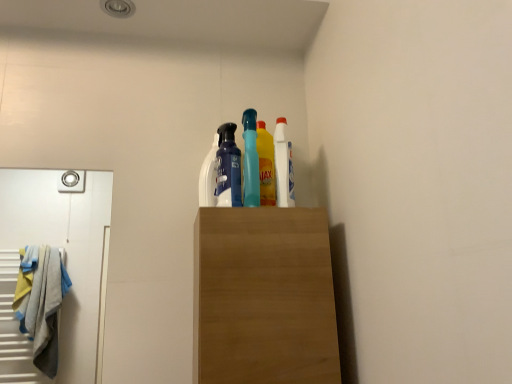
What do you see at coordinates (283, 165) in the screenshot?
I see `white plastic bottle at upper center, marked as the 1th cleaning product in a right-to-left arrangement` at bounding box center [283, 165].

The width and height of the screenshot is (512, 384). In order to click on matte blue spray bottle at center in this screenshot , I will do `click(228, 168)`.

This screenshot has height=384, width=512. Describe the element at coordinates (208, 176) in the screenshot. I see `white glossy bottle at upper center, which is the 1th cleaning product from left to right` at that location.

At what (x,y) coordinates should I click in order to perform the action: click on white plastic bottle at upper center, which ranks as the 2th cleaning product in left-to-right order. Please return your answer as a coordinate pair (x, y). This screenshot has width=512, height=384. Looking at the image, I should click on (283, 165).

From a real-world perspective, who is located lower, white plastic bottle at upper center, which ranks as the 2th cleaning product in left-to-right order, or white glossy bottle at upper center, the 2th cleaning product viewed from the right?

white plastic bottle at upper center, which ranks as the 2th cleaning product in left-to-right order.

Is white plastic bottle at upper center, which ranks as the 2th cleaning product in left-to-right order, completely or partially outside of white glossy bottle at upper center, the 2th cleaning product viewed from the right?

Yes, white plastic bottle at upper center, which ranks as the 2th cleaning product in left-to-right order, is located beyond the bounds of white glossy bottle at upper center, the 2th cleaning product viewed from the right.

Which object is wider, white plastic bottle at upper center, marked as the 1th cleaning product in a right-to-left arrangement, or white glossy bottle at upper center, which is the 1th cleaning product from left to right?

With larger width is white plastic bottle at upper center, marked as the 1th cleaning product in a right-to-left arrangement.

Is white glossy bottle at upper center, which is the 1th cleaning product from left to right, not close to white plastic bottle at upper center, which ranks as the 2th cleaning product in left-to-right order?

No, white glossy bottle at upper center, which is the 1th cleaning product from left to right, is not far away from white plastic bottle at upper center, which ranks as the 2th cleaning product in left-to-right order.

Considering the relative positions of white glossy bottle at upper center, which is the 1th cleaning product from left to right, and white plastic bottle at upper center, which ranks as the 2th cleaning product in left-to-right order, in the image provided, is white glossy bottle at upper center, which is the 1th cleaning product from left to right, to the left or to the right of white plastic bottle at upper center, which ranks as the 2th cleaning product in left-to-right order,?

white glossy bottle at upper center, which is the 1th cleaning product from left to right, is to the left of white plastic bottle at upper center, which ranks as the 2th cleaning product in left-to-right order.

Considering the sizes of white glossy bottle at upper center, the 2th cleaning product viewed from the right, and white plastic bottle at upper center, which ranks as the 2th cleaning product in left-to-right order, in the image, is white glossy bottle at upper center, the 2th cleaning product viewed from the right, wider or thinner than white plastic bottle at upper center, which ranks as the 2th cleaning product in left-to-right order,?

Considering their sizes, white glossy bottle at upper center, the 2th cleaning product viewed from the right, looks slimmer than white plastic bottle at upper center, which ranks as the 2th cleaning product in left-to-right order.

Does white glossy bottle at upper center, which is the 1th cleaning product from left to right, have a lesser height compared to white plastic bottle at upper center, marked as the 1th cleaning product in a right-to-left arrangement?

Yes.

Looking at this image, what's the angular difference between matte blue spray bottle at center and white glossy bottle at upper center, which is the 1th cleaning product from left to right,'s facing directions?

The angular difference between matte blue spray bottle at center and white glossy bottle at upper center, which is the 1th cleaning product from left to right, is 0.00452 degrees.

Consider the image. From a real-world perspective, is matte blue spray bottle at center on white glossy bottle at upper center, which is the 1th cleaning product from left to right?

Yes, from a real-world perspective, matte blue spray bottle at center is above white glossy bottle at upper center, which is the 1th cleaning product from left to right.

Can you confirm if matte blue spray bottle at center is smaller than white glossy bottle at upper center, which is the 1th cleaning product from left to right?

No.

Between white plastic bottle at upper center, marked as the 1th cleaning product in a right-to-left arrangement, and matte blue spray bottle at center, which one has less height?

matte blue spray bottle at center.

Is white plastic bottle at upper center, which ranks as the 2th cleaning product in left-to-right order, to the left of matte blue spray bottle at center from the viewer's perspective?

Incorrect, white plastic bottle at upper center, which ranks as the 2th cleaning product in left-to-right order, is not on the left side of matte blue spray bottle at center.

Which of these two, white plastic bottle at upper center, which ranks as the 2th cleaning product in left-to-right order, or matte blue spray bottle at center, is wider?

matte blue spray bottle at center.

Does point (278, 135) come in front of point (217, 163)?

Yes, it is.

Is matte blue spray bottle at center wider than white plastic bottle at upper center, which ranks as the 2th cleaning product in left-to-right order?

Yes, matte blue spray bottle at center is wider than white plastic bottle at upper center, which ranks as the 2th cleaning product in left-to-right order.

Considering the positions of objects matte blue spray bottle at center and white plastic bottle at upper center, marked as the 1th cleaning product in a right-to-left arrangement, in the image provided, who is behind, matte blue spray bottle at center or white plastic bottle at upper center, marked as the 1th cleaning product in a right-to-left arrangement,?

Positioned behind is white plastic bottle at upper center, marked as the 1th cleaning product in a right-to-left arrangement.

Are matte blue spray bottle at center and white plastic bottle at upper center, marked as the 1th cleaning product in a right-to-left arrangement, making contact?

No, matte blue spray bottle at center is not with white plastic bottle at upper center, marked as the 1th cleaning product in a right-to-left arrangement.

In order to click on the 2nd cleaning product below the matte blue spray bottle at center (from the image's perspective) in this screenshot , I will do `click(208, 176)`.

Is white glossy bottle at upper center, which is the 1th cleaning product from left to right, at the left side of matte blue spray bottle at center?

Correct, you'll find white glossy bottle at upper center, which is the 1th cleaning product from left to right, to the left of matte blue spray bottle at center.

Is the position of white glossy bottle at upper center, the 2th cleaning product viewed from the right, more distant than that of matte blue spray bottle at center?

Yes, it is behind matte blue spray bottle at center.

You are a GUI agent. You are given a task and a screenshot of the screen. Output one action in this format:
    pyautogui.click(x=<x>, y=<y>)
    Task: Click on the cleaning product located on the right of white glossy bottle at upper center, which is the 1th cleaning product from left to right
    This screenshot has height=384, width=512.
    Given the screenshot: What is the action you would take?
    pyautogui.click(x=283, y=165)

I want to click on cleaning product in front of the white glossy bottle at upper center, the 2th cleaning product viewed from the right, so click(x=283, y=165).

Considering their positions, is white glossy bottle at upper center, which is the 1th cleaning product from left to right, positioned closer to white plastic bottle at upper center, which ranks as the 2th cleaning product in left-to-right order, than matte blue spray bottle at center?

The object closer to white plastic bottle at upper center, which ranks as the 2th cleaning product in left-to-right order, is matte blue spray bottle at center.

When comparing their distances from white plastic bottle at upper center, which ranks as the 2th cleaning product in left-to-right order, does matte blue spray bottle at center or white glossy bottle at upper center, the 2th cleaning product viewed from the right, seem closer?

matte blue spray bottle at center is closer to white plastic bottle at upper center, which ranks as the 2th cleaning product in left-to-right order.

Based on the photo, considering their positions, is white glossy bottle at upper center, the 2th cleaning product viewed from the right, positioned further to matte blue spray bottle at center than white plastic bottle at upper center, marked as the 1th cleaning product in a right-to-left arrangement?

The object further to matte blue spray bottle at center is white plastic bottle at upper center, marked as the 1th cleaning product in a right-to-left arrangement.

Based on their spatial positions, is white plastic bottle at upper center, which ranks as the 2th cleaning product in left-to-right order, or white glossy bottle at upper center, the 2th cleaning product viewed from the right, closer to matte blue spray bottle at center?

The object closer to matte blue spray bottle at center is white glossy bottle at upper center, the 2th cleaning product viewed from the right.

Which object lies further to the anchor point white glossy bottle at upper center, which is the 1th cleaning product from left to right, white plastic bottle at upper center, marked as the 1th cleaning product in a right-to-left arrangement, or matte blue spray bottle at center?

white plastic bottle at upper center, marked as the 1th cleaning product in a right-to-left arrangement, is positioned further to the anchor white glossy bottle at upper center, which is the 1th cleaning product from left to right.

Estimate the real-world distances between objects in this image. Which object is further from white glossy bottle at upper center, which is the 1th cleaning product from left to right, matte blue spray bottle at center or white plastic bottle at upper center, marked as the 1th cleaning product in a right-to-left arrangement?

Among the two, white plastic bottle at upper center, marked as the 1th cleaning product in a right-to-left arrangement, is located further to white glossy bottle at upper center, which is the 1th cleaning product from left to right.

Identify the location of bottle between white glossy bottle at upper center, the 2th cleaning product viewed from the right, and white plastic bottle at upper center, marked as the 1th cleaning product in a right-to-left arrangement, in the horizontal direction. The image size is (512, 384). (228, 168).